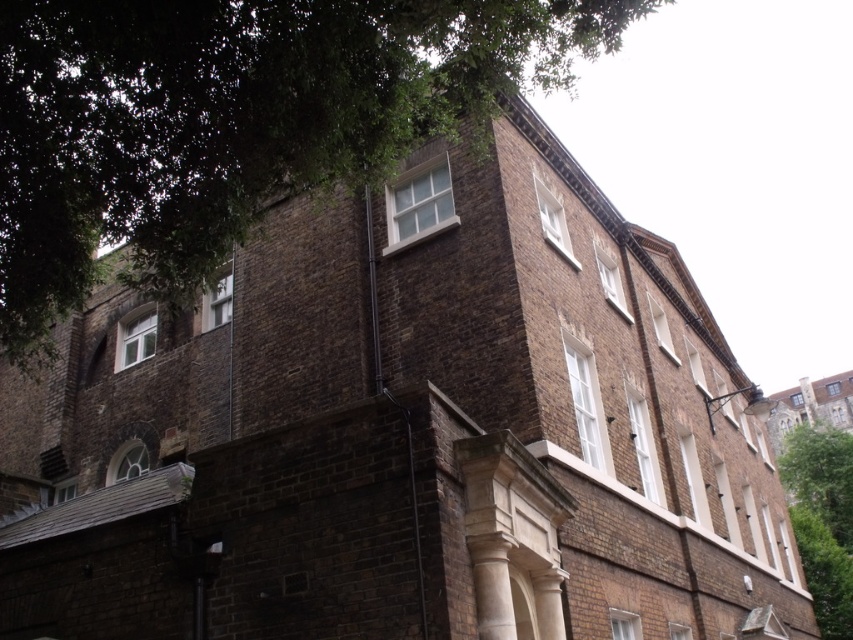
Question: Can you confirm if green leafy tree at right is positioned to the right of green leafy tree at lower right?

Choices:
 (A) yes
 (B) no

Answer: (A)

Question: Among these objects, which one is farthest from the camera?

Choices:
 (A) green leafy tree at lower right
 (B) green leafy tree at right

Answer: (B)

Question: Does green leafy tree at upper left lie behind green leafy tree at right?

Choices:
 (A) yes
 (B) no

Answer: (B)

Question: Is green leafy tree at upper left further to camera compared to green leafy tree at lower right?

Choices:
 (A) no
 (B) yes

Answer: (A)

Question: Which point appears closest to the camera in this image?

Choices:
 (A) (350, 163)
 (B) (815, 593)

Answer: (A)

Question: Which of these objects is positioned closest to the green leafy tree at right?

Choices:
 (A) green leafy tree at lower right
 (B) green leafy tree at upper left

Answer: (A)